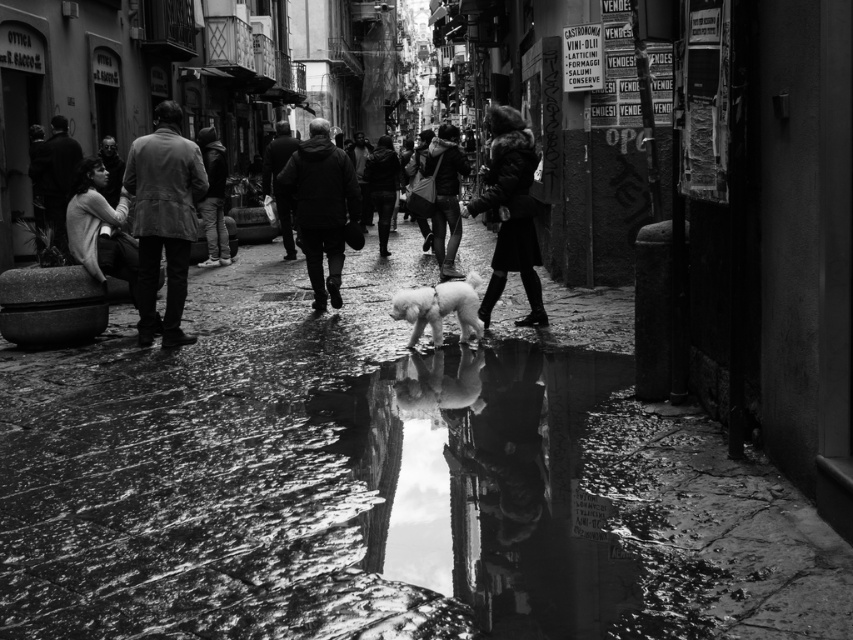
Question: Which object is closer to the camera taking this photo?

Choices:
 (A) fluffy white dog at center
 (B) leather jacket at left
 (C) dark matte coat at center
 (D) wet stone pavement at center

Answer: (D)

Question: Considering the relative positions of wet stone pavement at center and leather jacket at left in the image provided, where is wet stone pavement at center located with respect to leather jacket at left?

Choices:
 (A) left
 (B) right

Answer: (B)

Question: Which object is closer to the camera taking this photo?

Choices:
 (A) dark gray jacket at center
 (B) leather jacket at center
 (C) dark matte coat at center
 (D) fur coat at center

Answer: (D)

Question: Is leather jacket at left wider than fur coat at center?

Choices:
 (A) no
 (B) yes

Answer: (B)

Question: From the image, what is the correct spatial relationship of wet stone pavement at center in relation to dark matte coat at center?

Choices:
 (A) right
 (B) left

Answer: (A)

Question: Which of the following is the closest to the observer?

Choices:
 (A) dark woolen coat at center
 (B) dark gray jacket at center
 (C) fluffy white dog at center

Answer: (C)